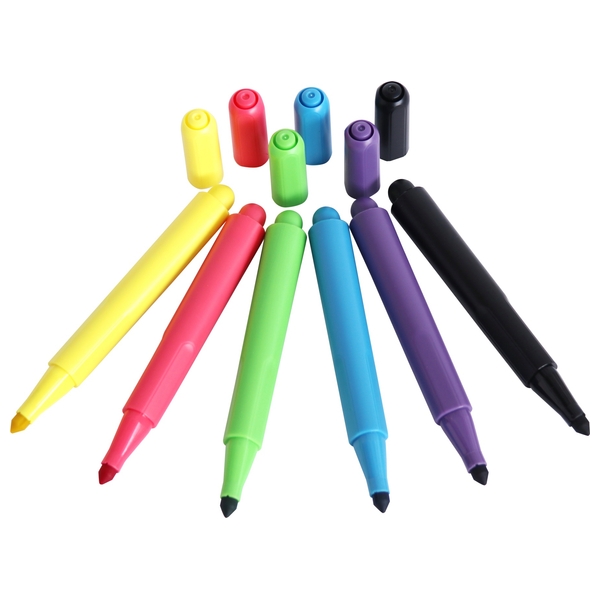
You are a GUI agent. You are given a task and a screenshot of the screen. Output one action in this format:
    pyautogui.click(x=<x>, y=<y>)
    Task: Click on the marker caps
    Image resolution: width=600 pixels, height=600 pixels.
    Given the screenshot: What is the action you would take?
    pyautogui.click(x=215, y=137), pyautogui.click(x=261, y=115), pyautogui.click(x=289, y=170), pyautogui.click(x=322, y=123), pyautogui.click(x=365, y=166), pyautogui.click(x=393, y=119)